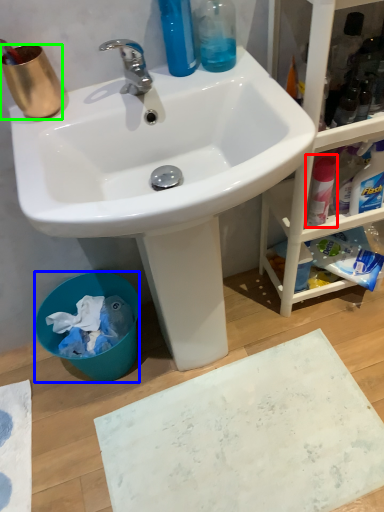
Question: Based on their relative distances, which object is farther from cleaning product (highlighted by a red box)? Choose from trash bin/can (highlighted by a blue box) and coffee cup (highlighted by a green box).

Choices:
 (A) trash bin/can
 (B) coffee cup

Answer: (A)